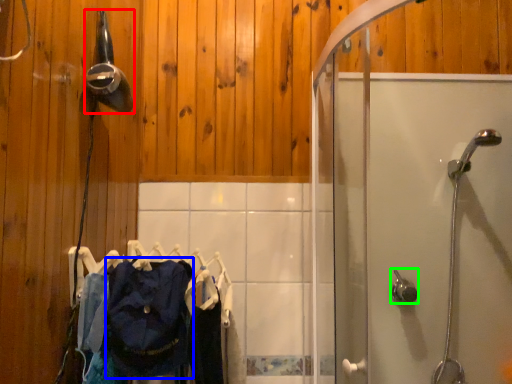
Question: Which is nearer to the shower (highlighted by a red box)? clothing (highlighted by a blue box) or shower (highlighted by a green box).

Choices:
 (A) clothing
 (B) shower

Answer: (A)